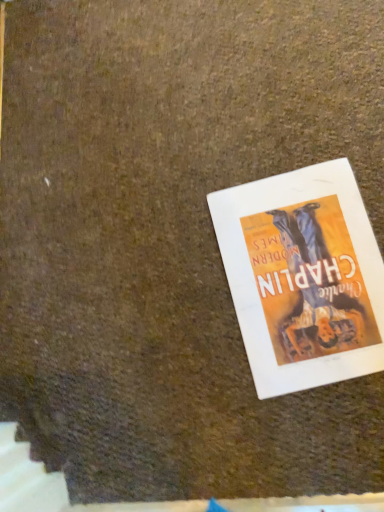
Where is `white paper poster at center`? The height and width of the screenshot is (512, 384). white paper poster at center is located at coordinates (303, 277).

Describe the element at coordinates (303, 277) in the screenshot. I see `white paper poster at center` at that location.

The width and height of the screenshot is (384, 512). I want to click on white paper poster at center, so click(x=303, y=277).